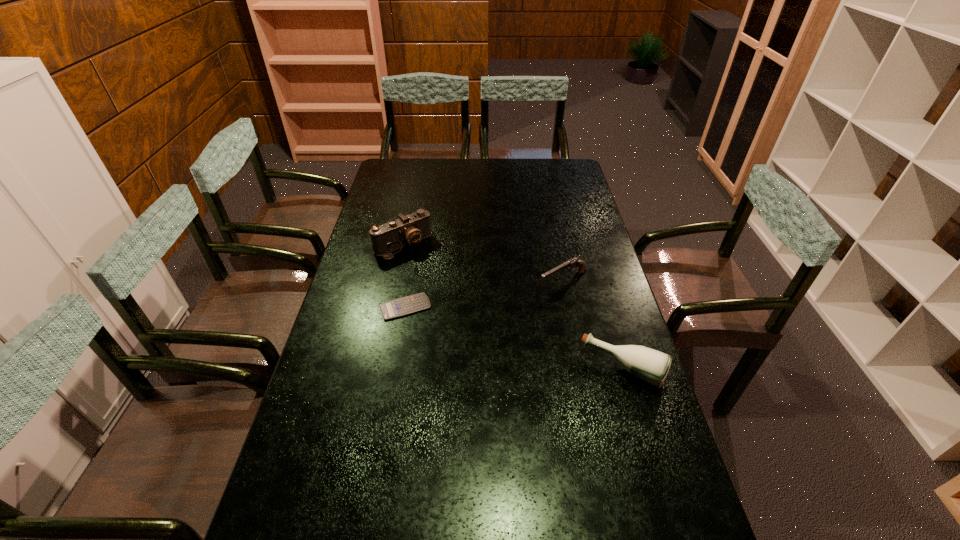
I want to click on calculator, so click(x=399, y=307).

Image resolution: width=960 pixels, height=540 pixels. Find the location of `bottle`. bottle is located at coordinates [652, 366].

I want to click on gun, so click(x=573, y=262).

Where is `camera`? This screenshot has width=960, height=540. camera is located at coordinates (408, 230).

You are a GUI agent. You are given a task and a screenshot of the screen. Output one action in this format:
    pyautogui.click(x=<x>, y=<y>)
    Task: Click on the farthest object
    The image size is (960, 540).
    Given the screenshot: What is the action you would take?
    pyautogui.click(x=408, y=230)

Image resolution: width=960 pixels, height=540 pixels. In order to click on vacant space located 0.210m on the front of the calculator in this screenshot , I will do `click(393, 377)`.

Find the location of a particular element. vacant space located 0.260m on the front of the bottle is located at coordinates (660, 495).

Image resolution: width=960 pixels, height=540 pixels. Find the location of `blank space located aiming along the barrel of the gun`. blank space located aiming along the barrel of the gun is located at coordinates (471, 332).

Find the location of a particular element. The width and height of the screenshot is (960, 540). vacant region located 0.120m aiming along the barrel of the gun is located at coordinates point(516,306).

Image resolution: width=960 pixels, height=540 pixels. Find the location of `free space located aiming along the barrel of the gun`. free space located aiming along the barrel of the gun is located at coordinates (476, 328).